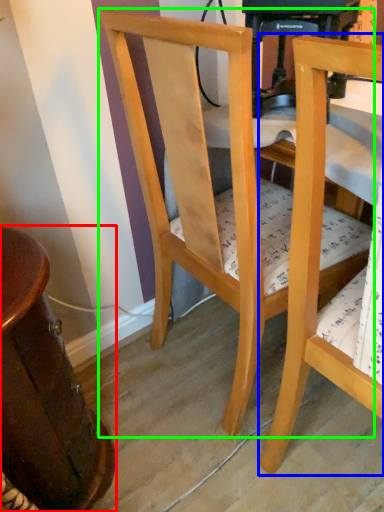
Question: Which object is the closest to the table (highlighted by a red box)? Choose among these: chair (highlighted by a blue box) or chair (highlighted by a green box).

Choices:
 (A) chair
 (B) chair

Answer: (B)